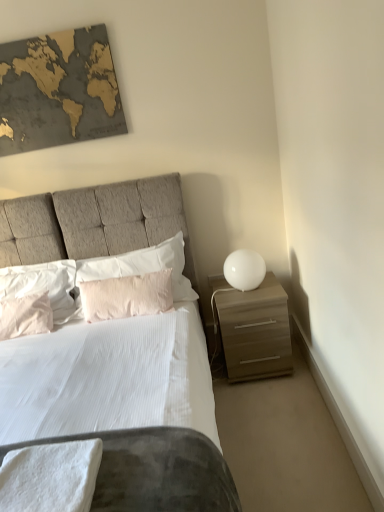
Question: From a real-world perspective, is white soft pillow at center, the 1th pillow in the right-to-left sequence, above or below white glossy sphere at right?

Choices:
 (A) below
 (B) above

Answer: (B)

Question: Considering their positions, is white soft pillow at center, the 1th pillow in the right-to-left sequence, located in front of or behind white glossy sphere at right?

Choices:
 (A) behind
 (B) front

Answer: (A)

Question: Considering the real-world distances, which object is farthest from the matte brown nightstand at right?

Choices:
 (A) white soft pillow at center, the 4th pillow when ordered from left to right
 (B) white soft towel at lower left
 (C) pink cotton pillow at left, the 4th pillow in the right-to-left sequence
 (D) white glossy sphere at right
 (E) pale pink fabric pillow at center, positioned as the second pillow in right-to-left order

Answer: (B)

Question: Which object is positioned farthest from the white soft towel at lower left?

Choices:
 (A) white soft pillow at center, the 1th pillow in the right-to-left sequence
 (B) white glossy sphere at right
 (C) pale pink fabric pillow at center, which is counted as the third pillow, starting from the left
 (D) gold textured map at upper left
 (E) matte brown nightstand at right

Answer: (D)